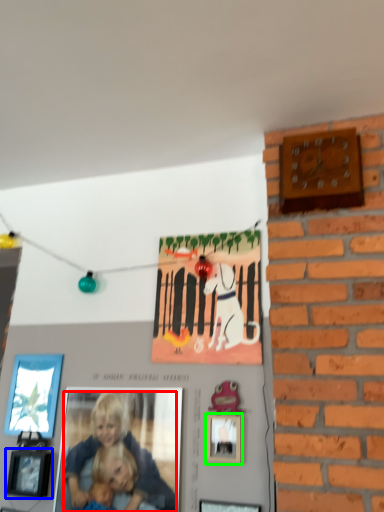
Question: Which object is positioned farthest from person (highlighted by a red box)? Select from picture frame (highlighted by a blue box) and picture frame (highlighted by a green box).

Choices:
 (A) picture frame
 (B) picture frame

Answer: (B)